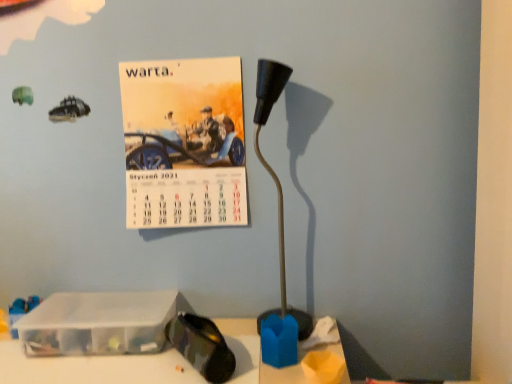
Where is `matte paper calendar at upper left`? The height and width of the screenshot is (384, 512). matte paper calendar at upper left is located at coordinates pos(184,143).

Does black plastic lamp at center lie behind transparent plastic container at lower left?

No, it is in front of transparent plastic container at lower left.

Can you confirm if black plastic lamp at center is positioned to the left of transparent plastic container at lower left?

In fact, black plastic lamp at center is to the right of transparent plastic container at lower left.

How far apart are black plastic lamp at center and transparent plastic container at lower left?

black plastic lamp at center is 41.41 centimeters from transparent plastic container at lower left.

Is black plastic lamp at center thinner than transparent plastic container at lower left?

Yes.

Considering the positions of objects matte paper calendar at upper left and black plastic lamp at center in the image provided, who is in front, matte paper calendar at upper left or black plastic lamp at center?

Positioned in front is black plastic lamp at center.

Is matte paper calendar at upper left to the right of black plastic lamp at center from the viewer's perspective?

No.

Identify the location of postcard that is behind the black plastic lamp at center. (184, 143).

Who is smaller, matte paper calendar at upper left or black plastic lamp at center?

Smaller between the two is black plastic lamp at center.

Which of these two, black plastic lamp at center or matte paper calendar at upper left, is thinner?

matte paper calendar at upper left.

Is black plastic lamp at center positioned in front of matte paper calendar at upper left?

Yes, it is.

Does black plastic lamp at center appear on the right side of matte paper calendar at upper left?

Yes.

Is black plastic lamp at center positioned with its back to matte paper calendar at upper left?

No, matte paper calendar at upper left is not at the back of black plastic lamp at center.

Can you tell me how much matte paper calendar at upper left and transparent plastic container at lower left differ in facing direction?

The angular difference between matte paper calendar at upper left and transparent plastic container at lower left is 9.65 degrees.

Does matte paper calendar at upper left contain transparent plastic container at lower left?

No, transparent plastic container at lower left is not surrounded by matte paper calendar at upper left.

Does matte paper calendar at upper left have a larger size compared to transparent plastic container at lower left?

Yes.

Could you tell me if matte paper calendar at upper left is facing transparent plastic container at lower left?

No, matte paper calendar at upper left does not turn towards transparent plastic container at lower left.

Based on the photo, who is bigger, transparent plastic container at lower left or matte paper calendar at upper left?

matte paper calendar at upper left.

Which object is positioned more to the right, transparent plastic container at lower left or matte paper calendar at upper left?

matte paper calendar at upper left is more to the right.

Is transparent plastic container at lower left situated inside matte paper calendar at upper left or outside?

transparent plastic container at lower left lies outside matte paper calendar at upper left.

Locate an element on the screen. This screenshot has width=512, height=384. postcard above the transparent plastic container at lower left (from the image's perspective) is located at coordinates (184, 143).

Is black plastic lamp at center completely or partially inside transparent plastic container at lower left?

No, transparent plastic container at lower left does not contain black plastic lamp at center.

Is the depth of transparent plastic container at lower left less than that of black plastic lamp at center?

No, the depth of transparent plastic container at lower left is greater than that of black plastic lamp at center.

Which is closer, (108, 310) or (297, 318)?

The point (297, 318) is in front.

The width and height of the screenshot is (512, 384). In the image, there is a black plastic lamp at center. Identify the location of box below it (from the image's perspective). (99, 323).

Find the location of a particular element. The width and height of the screenshot is (512, 384). lamp in front of the matte paper calendar at upper left is located at coordinates (272, 169).

Estimate the real-world distances between objects in this image. Which object is further from matte paper calendar at upper left, transparent plastic container at lower left or black plastic lamp at center?

Among the two, transparent plastic container at lower left is located further to matte paper calendar at upper left.

From the image, which object appears to be nearer to transparent plastic container at lower left, black plastic lamp at center or matte paper calendar at upper left?

matte paper calendar at upper left is positioned closer to the anchor transparent plastic container at lower left.

Looking at the image, which one is located further to matte paper calendar at upper left, black plastic lamp at center or transparent plastic container at lower left?

transparent plastic container at lower left is positioned further to the anchor matte paper calendar at upper left.

Considering their positions, is matte paper calendar at upper left positioned further to black plastic lamp at center than transparent plastic container at lower left?

transparent plastic container at lower left is further to black plastic lamp at center.

Which object lies further to the anchor point transparent plastic container at lower left, matte paper calendar at upper left or black plastic lamp at center?

black plastic lamp at center is further to transparent plastic container at lower left.

Which object lies nearer to the anchor point black plastic lamp at center, transparent plastic container at lower left or matte paper calendar at upper left?

matte paper calendar at upper left is positioned closer to the anchor black plastic lamp at center.

The height and width of the screenshot is (384, 512). Find the location of `lamp between matte paper calendar at upper left and transparent plastic container at lower left in the vertical direction`. lamp between matte paper calendar at upper left and transparent plastic container at lower left in the vertical direction is located at coordinates (272, 169).